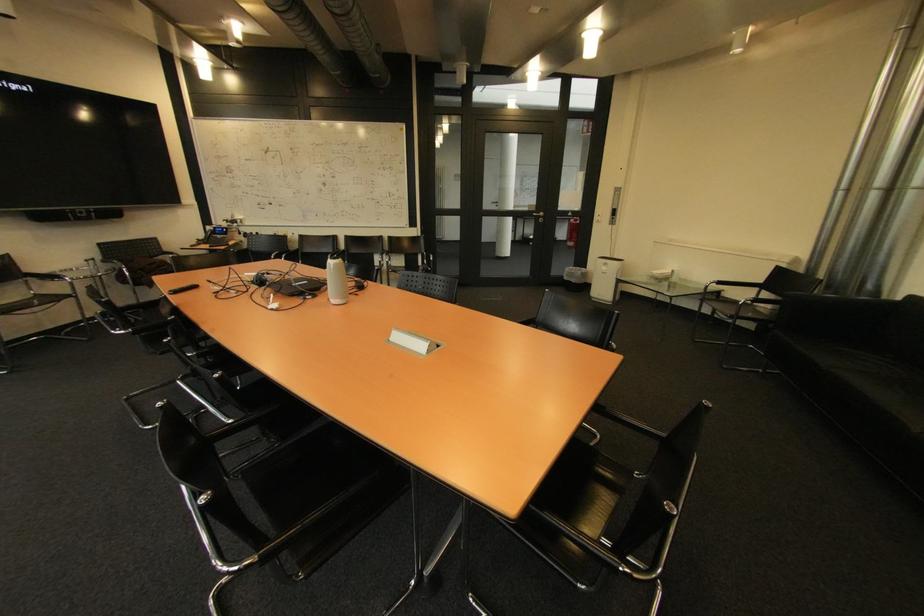
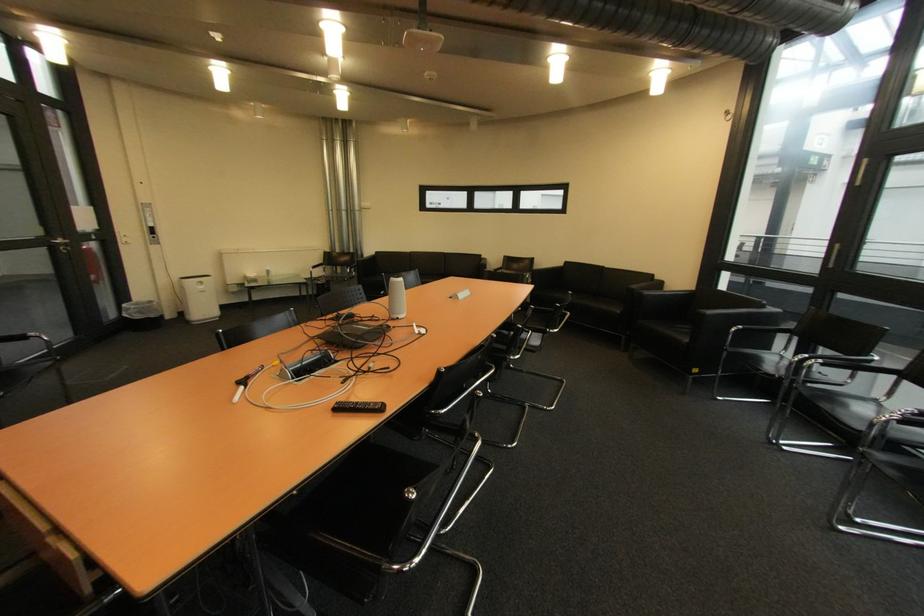
Where in the second image is the point corresponding to pixel 550 215 from the first image?

(68, 241)